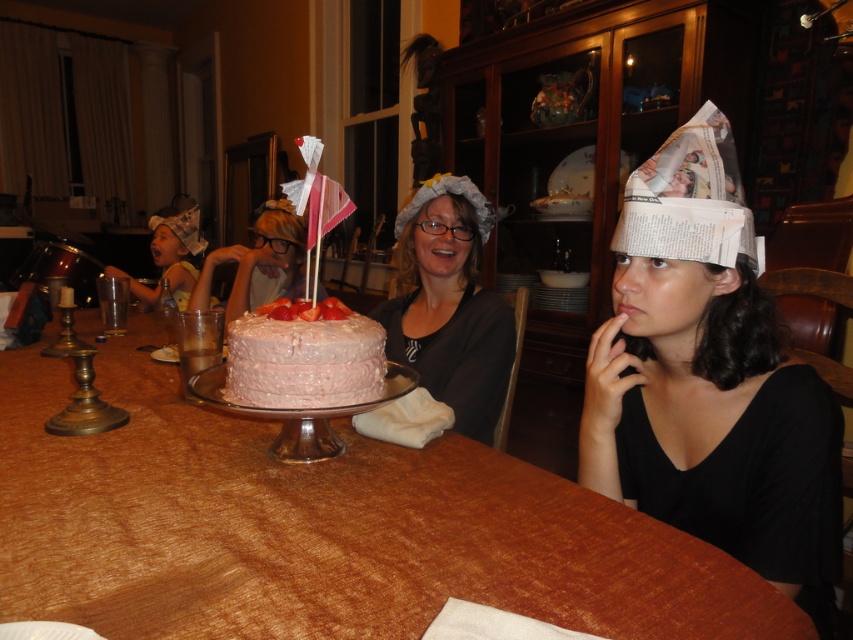
Can you confirm if wooden table at center is positioned below white newspaper hat at center?

Correct, wooden table at center is located below white newspaper hat at center.

Which is in front, point (129, 369) or point (637, 260)?

Point (637, 260) is in front.

You are a GUI agent. You are given a task and a screenshot of the screen. Output one action in this format:
    pyautogui.click(x=<x>, y=<y>)
    Task: Click on the wooden table at center
    
    Given the screenshot: What is the action you would take?
    pyautogui.click(x=320, y=528)

Can you confirm if white newspaper hat at center is bigger than matte gray fabric hat at center?

No, white newspaper hat at center is not bigger than matte gray fabric hat at center.

Which of these two, white newspaper hat at center or matte gray fabric hat at center, stands shorter?

Standing shorter between the two is matte gray fabric hat at center.

Where is `white newspaper hat at center`? The image size is (853, 640). white newspaper hat at center is located at coordinates (711, 380).

Is wooden table at center to the left of matte gray fabric hat at center from the viewer's perspective?

Correct, you'll find wooden table at center to the left of matte gray fabric hat at center.

Is wooden table at center below matte gray fabric hat at center?

Yes, wooden table at center is below matte gray fabric hat at center.

Who is more forward, (555, 612) or (444, 230)?

Point (555, 612)

Identify the location of wooden table at center. (320, 528).